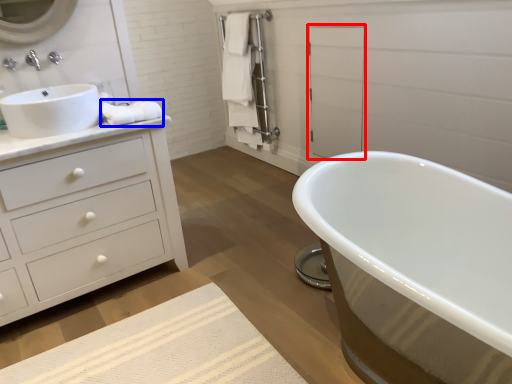
Question: Which object is further to the camera taking this photo, screen door (highlighted by a red box) or material (highlighted by a blue box)?

Choices:
 (A) screen door
 (B) material

Answer: (A)